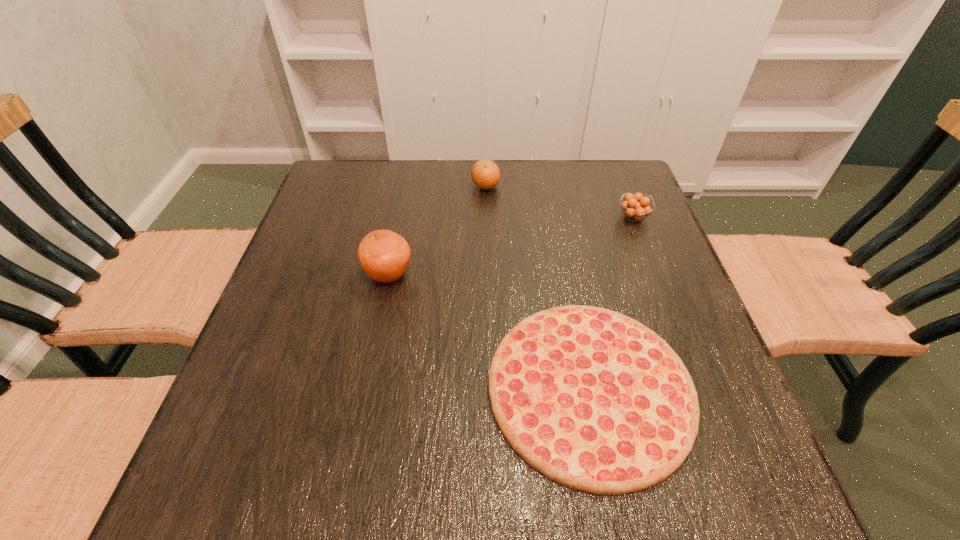
Locate an element on the screen. The height and width of the screenshot is (540, 960). vacant space that is in between the shortest orange fruit and the pizza is located at coordinates click(612, 302).

In order to click on vacant area between the shortest orange fruit and the pizza in this screenshot , I will do `click(612, 302)`.

Find the location of a particular element. Image resolution: width=960 pixels, height=540 pixels. vacant area between the second farthest orange fruit and the pizza is located at coordinates (612, 302).

Locate an element on the screen. object that stands as the third closest to the shortest object is located at coordinates tap(485, 174).

This screenshot has height=540, width=960. I want to click on object that is the third nearest to the leftmost object, so click(636, 206).

Find the location of a particular element. This screenshot has width=960, height=540. orange fruit that is the closest to the shortest orange fruit is located at coordinates (485, 174).

Point out which orange fruit is positioned as the nearest to the tallest object. Please provide its 2D coordinates. Your answer should be formatted as a tuple, i.e. [(x, y)], where the tuple contains the x and y coordinates of a point satisfying the conditions above.

[(485, 174)]

Where is `vacant position in the image that satisfies the following two spatial constraints: 1. on the front side of the second orange fruit from right to left; 2. on the right side of the rightmost orange fruit`? vacant position in the image that satisfies the following two spatial constraints: 1. on the front side of the second orange fruit from right to left; 2. on the right side of the rightmost orange fruit is located at coordinates (486, 218).

The image size is (960, 540). In order to click on free region that satisfies the following two spatial constraints: 1. on the front side of the tallest orange fruit; 2. on the left side of the nearest object in this screenshot , I will do `click(366, 388)`.